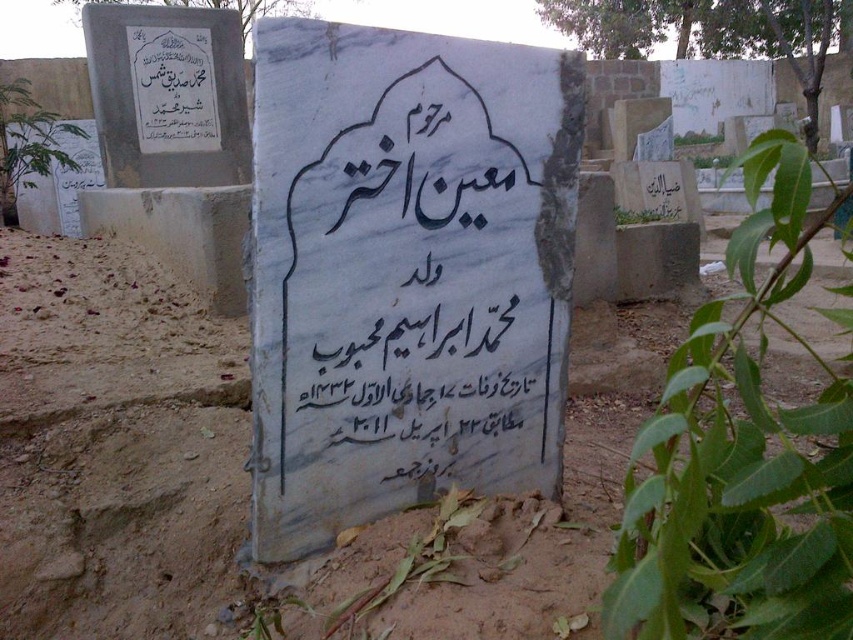
Consider the image. Between white marble gravestone at center and brown sandy dirt at center, which one appears on the left side from the viewer's perspective?

From the viewer's perspective, brown sandy dirt at center appears more on the left side.

Who is positioned more to the right, white marble gravestone at center or brown sandy dirt at center?

Positioned to the right is white marble gravestone at center.

Between point (500, 304) and point (584, 502), which one is positioned in front?

Point (500, 304)

Locate an element on the screen. Image resolution: width=853 pixels, height=640 pixels. white marble gravestone at center is located at coordinates (405, 272).